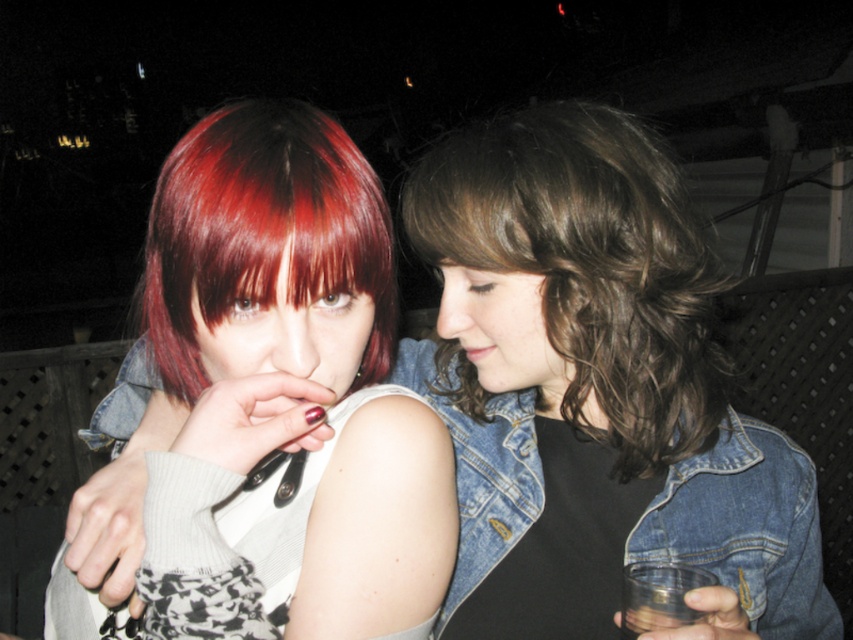
Based on the coordinates provided in the scene description, where exactly is the shiny red hair at center located?

The shiny red hair at center is located at point coordinates of 0.362 on the x axis and 0.309 on the y axis.

You are a photographer trying to capture a clear photo of the brown wavy hair at center. However, the matte red hair at center is blocking the view. Can you adjust your position to take the photo without moving either person?

The matte red hair at center is in front of the brown wavy hair at center, so you would need to move around to the side or behind the matte red hair at center to capture the brown wavy hair at center without obstruction.